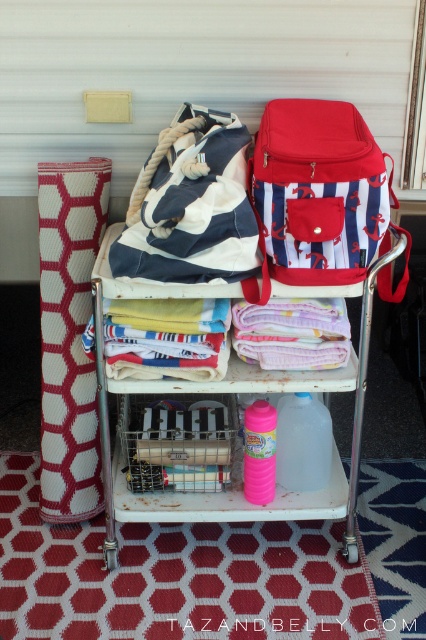
Does red striped backpack at upper right come behind white metal cart at center?

That is False.

Image resolution: width=426 pixels, height=640 pixels. Describe the element at coordinates (319, 189) in the screenshot. I see `red striped backpack at upper right` at that location.

Find the location of a particular element. red striped backpack at upper right is located at coordinates (319, 189).